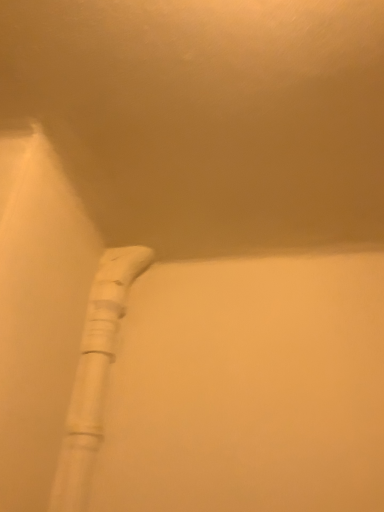
Question: Should I look upward or downward to see white textured shower at center?

Choices:
 (A) up
 (B) down

Answer: (B)